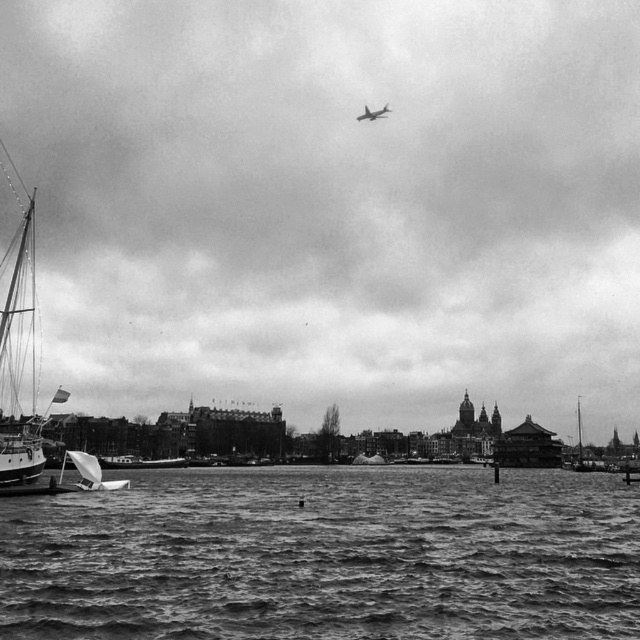
You are a photographer trying to capture both the white plastic sailboat at lower left and the metallic silver airplane at upper center in the same frame. Based on their positions, which object should you adjust your camera to focus on first to ensure both are in the shot?

The white plastic sailboat at lower left is positioned on the left side of the metallic silver airplane at upper center, so you should focus on the metallic silver airplane at upper center first to ensure both are included in the frame.